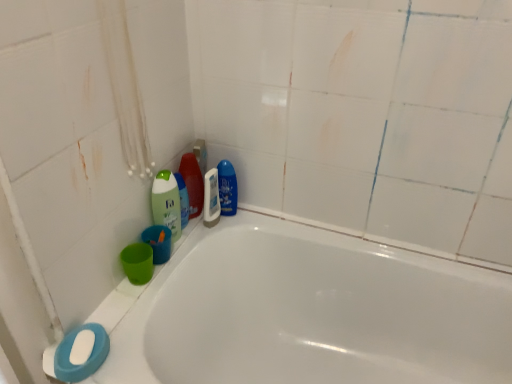
Locate an element on the screen. vacant space in front of green matte bottle at upper left, the first cleaning product positioned from the left is located at coordinates [151, 284].